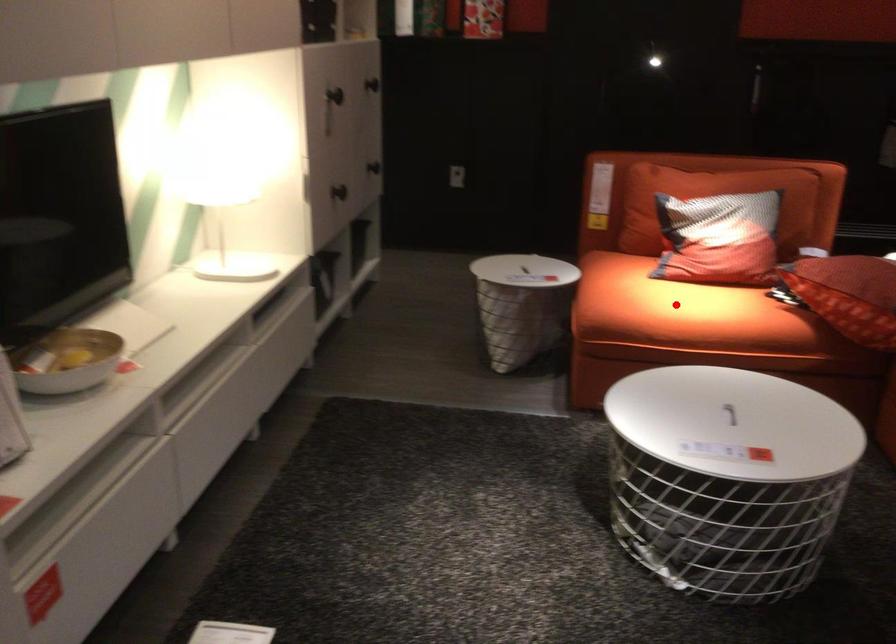
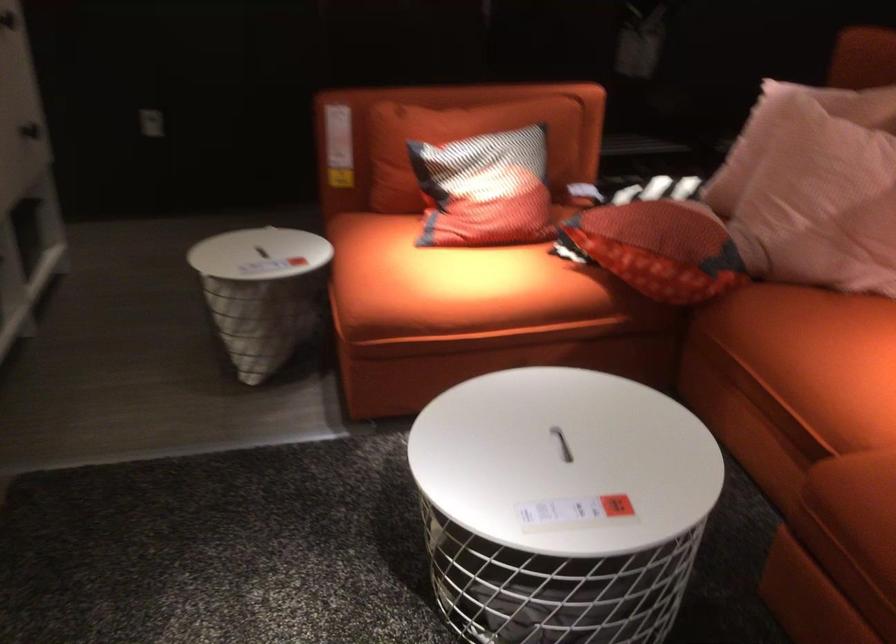
Question: I am providing you with two images of the same scene from different viewpoints. A red point is shown in image1. For the corresponding object point in image2, is it positioned nearer or farther from the camera?

Choices:
 (A) Nearer
 (B) Farther

Answer: (A)